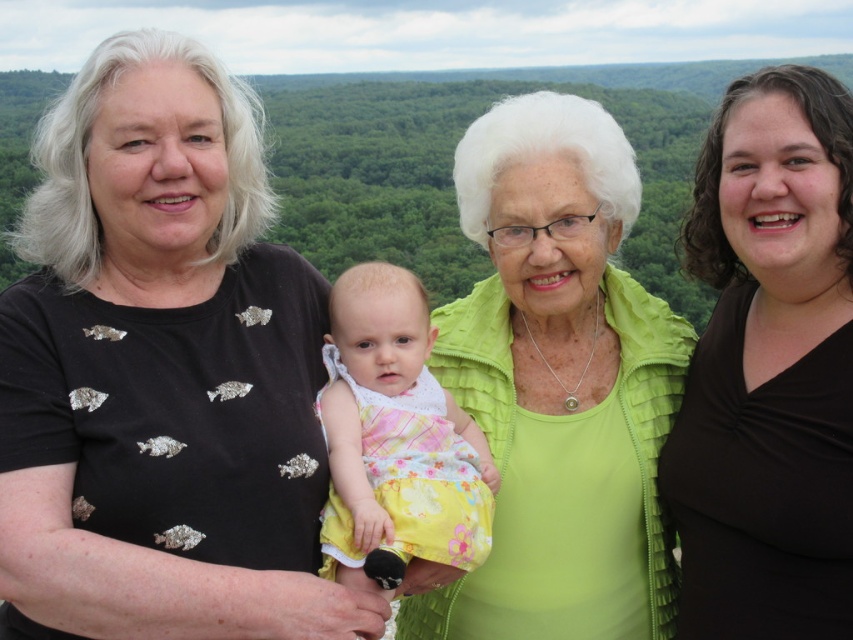
You are a photographer trying to adjust the lighting for a group photo. You notice the green textured jacket at upper center and the yellow floral dress at center. Which one is located to the right of the other?

The green textured jacket at upper center is positioned on the right side of yellow floral dress at center.